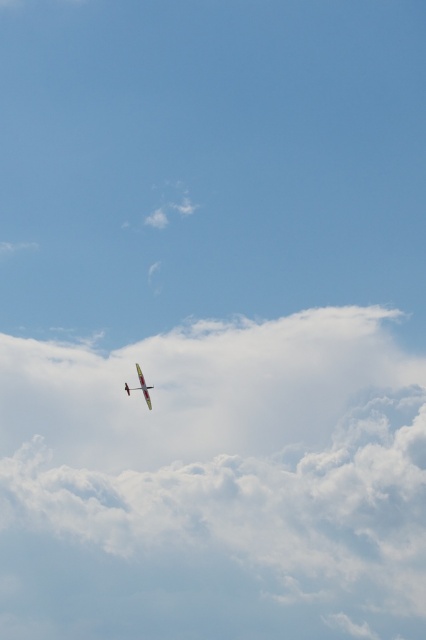
Question: Is white fluffy cloud at upper center positioned in front of metallic silver airplane at center?

Choices:
 (A) yes
 (B) no

Answer: (A)

Question: Is white fluffy cloud at upper center thinner than metallic silver airplane at center?

Choices:
 (A) yes
 (B) no

Answer: (B)

Question: Which of the following is the closest to the observer?

Choices:
 (A) white fluffy cloud at upper center
 (B) metallic silver airplane at center

Answer: (A)

Question: Does white fluffy cloud at upper center have a larger size compared to metallic silver airplane at center?

Choices:
 (A) yes
 (B) no

Answer: (A)

Question: Which object is closer to the camera taking this photo?

Choices:
 (A) white fluffy cloud at upper center
 (B) metallic silver airplane at center

Answer: (A)